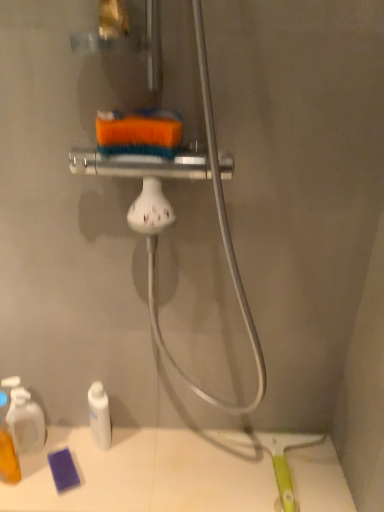
Question: Is white matte bottle at lower left, the 1th toiletry positioned from the right, situated inside translucent plastic bottle at lower left, placed as the third toiletry when sorted from right to left, or outside?

Choices:
 (A) outside
 (B) inside

Answer: (A)

Question: In terms of size, does white matte bottle at lower left, which is the 3th toiletry from left to right, appear bigger or smaller than translucent plastic bottle at lower left, placed as the third toiletry when sorted from right to left?

Choices:
 (A) big
 (B) small

Answer: (B)

Question: Based on their relative distances, which object is nearer to the translucent plastic spray bottle at lower left, arranged as the second toiletry when viewed from the left?

Choices:
 (A) translucent plastic bottle at lower left, placed as the third toiletry when sorted from right to left
 (B) white matte bottle at lower left, which is the 3th toiletry from left to right
 (C) purple sponge at lower left

Answer: (A)

Question: Which is nearer to the purple sponge at lower left?

Choices:
 (A) white matte bottle at lower left, which is the 3th toiletry from left to right
 (B) translucent plastic bottle at lower left, placed as the first toiletry when sorted from left to right
 (C) translucent plastic spray bottle at lower left, arranged as the second toiletry when viewed from the left

Answer: (A)